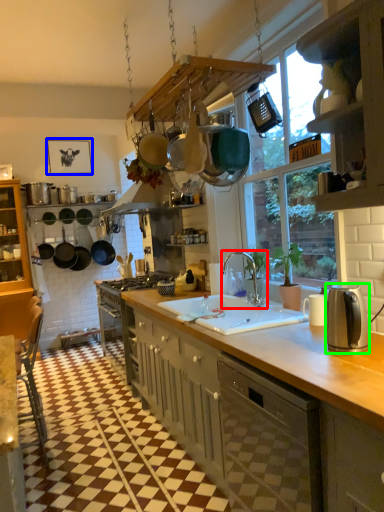
Question: Based on their relative distances, which object is farther from tap (highlighted by a red box)? Choose from picture frame (highlighted by a blue box) and kitchen appliance (highlighted by a green box).

Choices:
 (A) picture frame
 (B) kitchen appliance

Answer: (A)